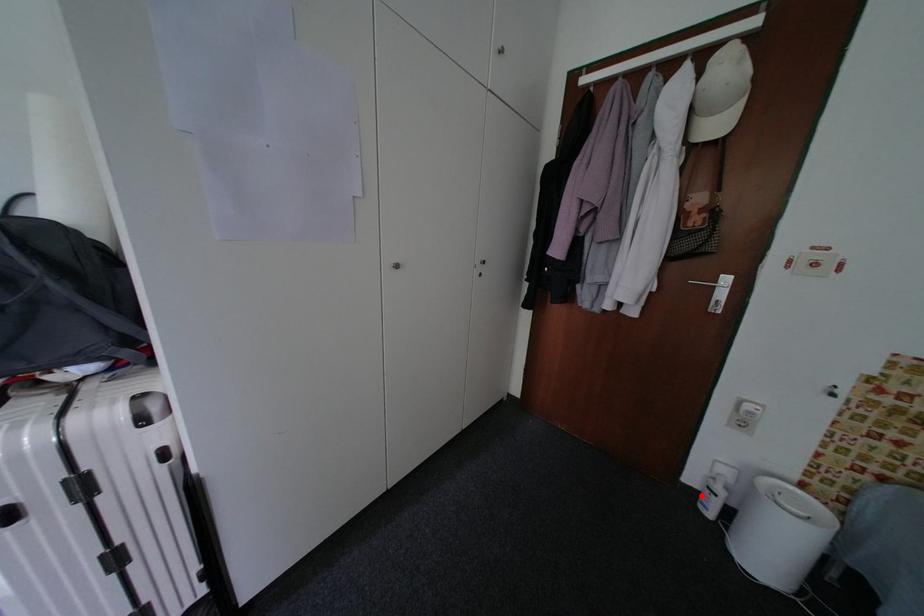
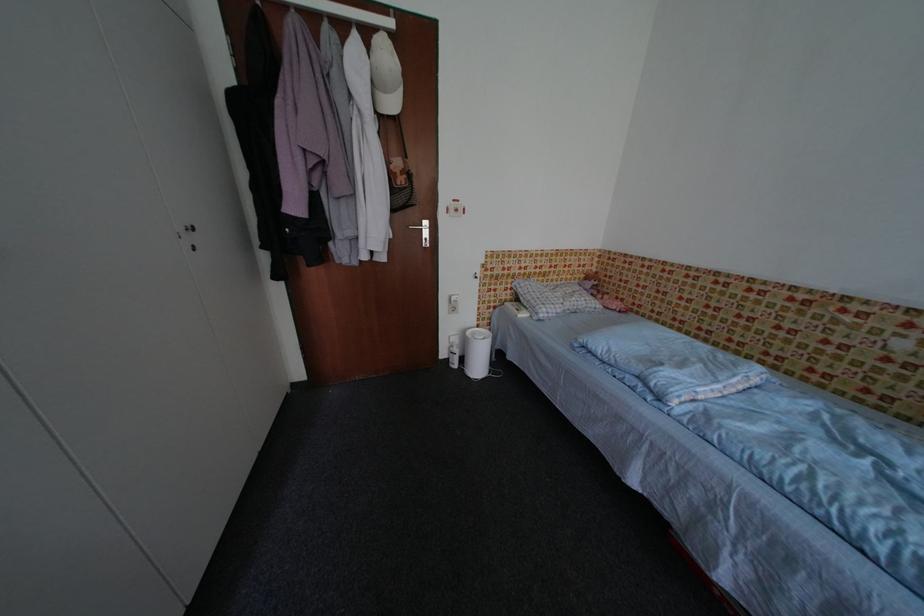
Question: I am providing you with two images of the same scene from different viewpoints. Given a red point in image1, look at the same physical point in image2. Is it:

Choices:
 (A) Closer to the viewpoint
 (B) Farther from the viewpoint

Answer: (B)